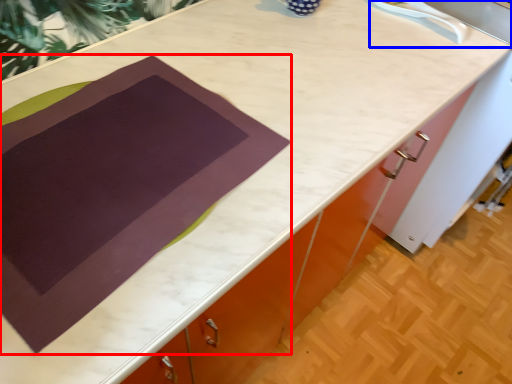
Question: Among these objects, which one is nearest to the camera, blanket (highlighted by a red box) or sink (highlighted by a blue box)?

Choices:
 (A) blanket
 (B) sink

Answer: (A)